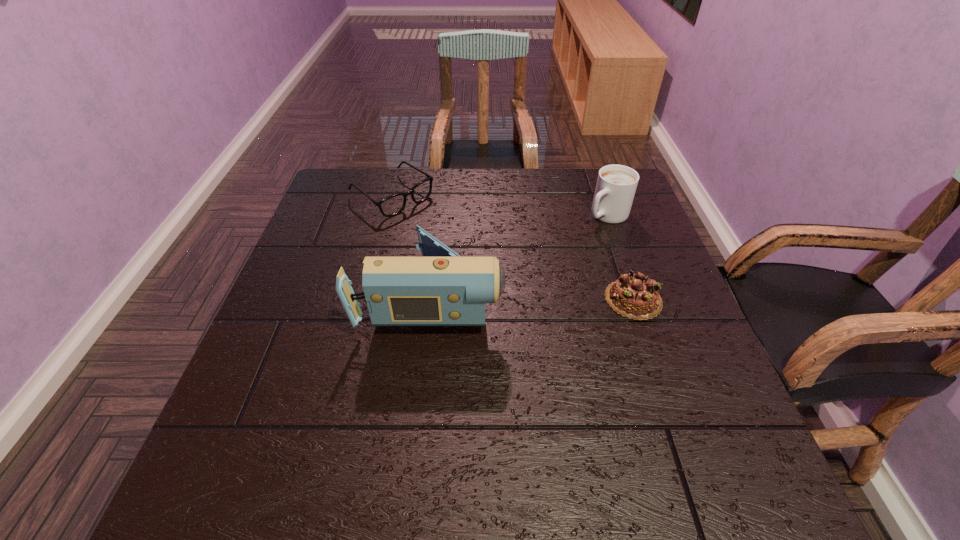
Locate an element on the screen. Image resolution: width=960 pixels, height=540 pixels. the tallest object is located at coordinates (441, 288).

You are a GUI agent. You are given a task and a screenshot of the screen. Output one action in this format:
    pyautogui.click(x=<x>, y=<y>)
    Task: Click on the chocolate cake
    The width and height of the screenshot is (960, 540).
    Given the screenshot: What is the action you would take?
    pyautogui.click(x=635, y=296)

The height and width of the screenshot is (540, 960). In order to click on the second tallest object in this screenshot , I will do `click(616, 185)`.

The height and width of the screenshot is (540, 960). Identify the location of spectacles. (392, 205).

Identify the location of vacant point located 0.130m on the side of the camcorder with the flip-out screen. The height and width of the screenshot is (540, 960). (561, 296).

You are a GUI agent. You are given a task and a screenshot of the screen. Output one action in this format:
    pyautogui.click(x=<x>, y=<y>)
    Task: Click on the vacant area situated 0.110m on the left of the chocolate cake
    The height and width of the screenshot is (540, 960).
    Given the screenshot: What is the action you would take?
    pyautogui.click(x=555, y=299)

This screenshot has height=540, width=960. Identify the location of blank space located 0.160m on the side with the handle of the cappuccino. (559, 254).

This screenshot has width=960, height=540. I want to click on vacant area located 0.160m on the side with the handle of the cappuccino, so click(x=559, y=254).

This screenshot has height=540, width=960. I want to click on blank area located 0.370m on the side with the handle of the cappuccino, so click(x=503, y=299).

The height and width of the screenshot is (540, 960). In order to click on vacant area situated 0.180m on the front-facing side of the spectacles in this screenshot , I will do `click(462, 244)`.